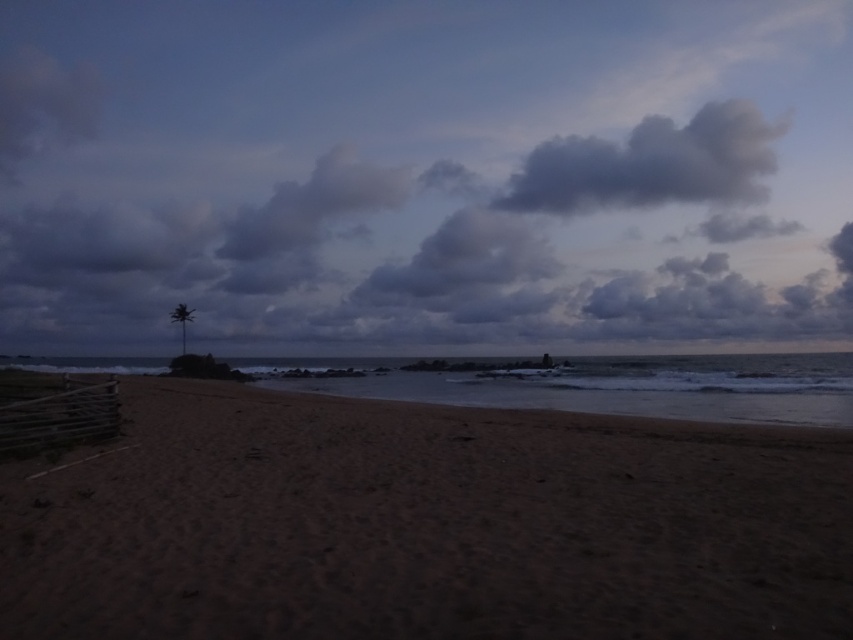
Question: Which point is closer to the camera?

Choices:
 (A) dark gray fluffy cloud at upper center
 (B) brown sandy beach at center
 (C) sandy water at center

Answer: (B)

Question: Does brown sandy beach at center have a lesser width compared to sandy water at center?

Choices:
 (A) yes
 (B) no

Answer: (A)

Question: In this image, where is sandy water at center located relative to green leafy palm tree at left?

Choices:
 (A) below
 (B) above

Answer: (A)

Question: Among these points, which one is farthest from the camera?

Choices:
 (A) (184, 305)
 (B) (772, 486)
 (C) (775, 397)
 (D) (268, 134)

Answer: (D)

Question: Is dark gray fluffy cloud at upper center to the right of green leafy palm tree at left from the viewer's perspective?

Choices:
 (A) no
 (B) yes

Answer: (B)

Question: Estimate the real-world distances between objects in this image. Which object is farther from the dark gray fluffy cloud at upper center?

Choices:
 (A) gray fluffy cloud at upper center
 (B) sandy water at center
 (C) brown sandy beach at center

Answer: (C)